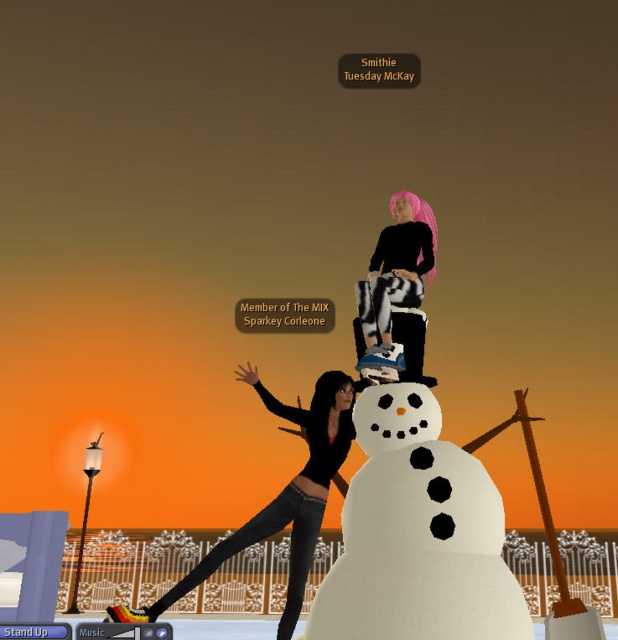
You are standing in front of the snowman and want to place a hat on the white fluffy snowman at center. The hat is too heavy to hold above your head. Can you place the hat on the snowman without reaching over the black matte pants at center?

The white fluffy snowman at center is closer to the viewer than the black matte pants at center, so you can place the hat on the snowman without needing to reach over the black matte pants at center since the snowman is in front of them.